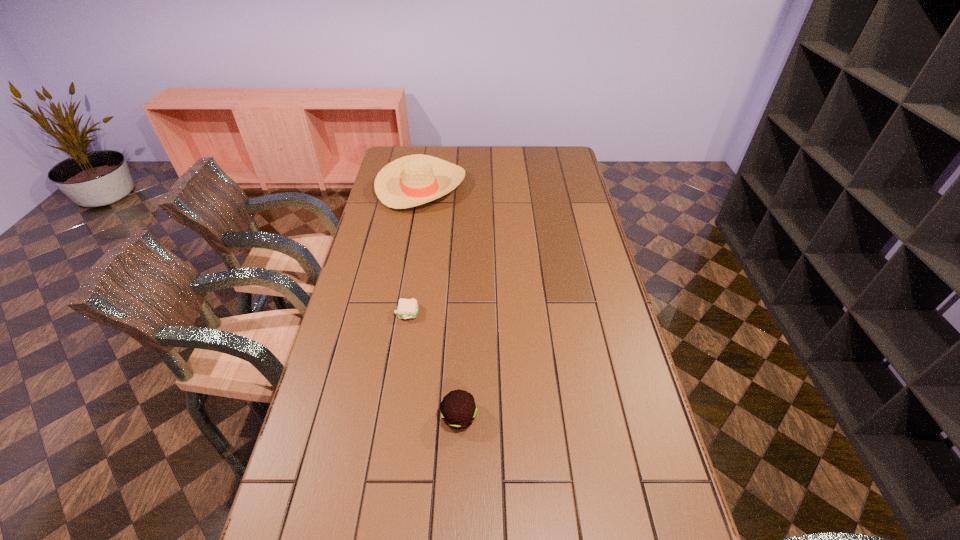
This screenshot has width=960, height=540. In order to click on object situated at the left edge in this screenshot , I will do [409, 181].

Identify the location of object that is at the far left corner. (409, 181).

What are the coordinates of `free location at the far edge of the desktop` in the screenshot? It's located at (487, 163).

Locate an element on the screen. free space at the left edge of the desktop is located at coordinates (378, 356).

Where is `vacant region at the right edge of the desktop`? This screenshot has width=960, height=540. vacant region at the right edge of the desktop is located at coordinates (575, 214).

Where is `vacant point located between the right patty and the farthest object`? vacant point located between the right patty and the farthest object is located at coordinates click(441, 302).

Locate an element on the screen. The height and width of the screenshot is (540, 960). unoccupied position between the shortest object and the nearest object is located at coordinates (433, 365).

You are a GUI agent. You are given a task and a screenshot of the screen. Output one action in this format:
    pyautogui.click(x=<x>, y=<y>)
    Task: Click on the free space that is in between the second farthest object and the nearer patty
    
    Given the screenshot: What is the action you would take?
    pyautogui.click(x=433, y=365)

Find the location of `blank region between the left patty and the sunhat`. blank region between the left patty and the sunhat is located at coordinates (415, 250).

Find the location of a particular element. This screenshot has width=960, height=540. free spot between the nearest object and the farther patty is located at coordinates (433, 365).